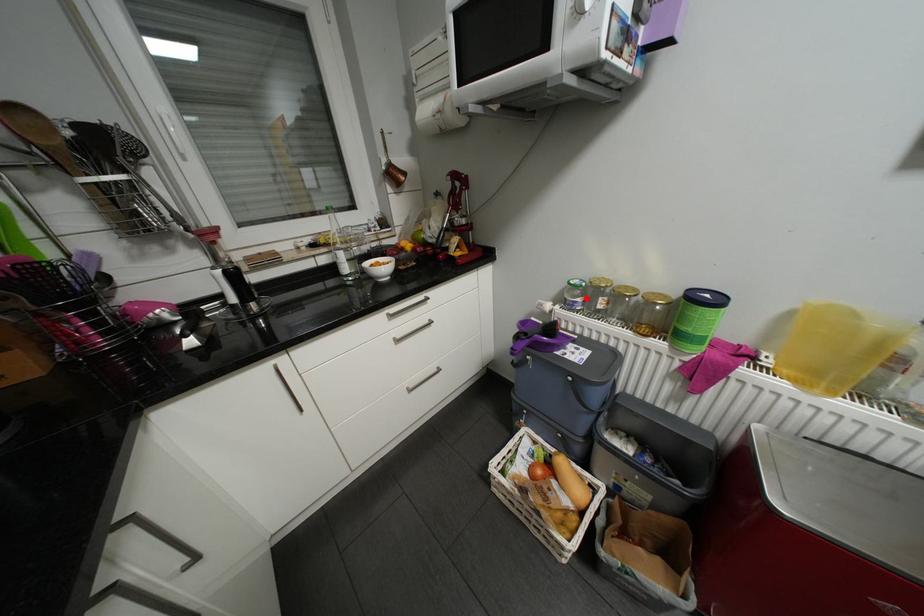
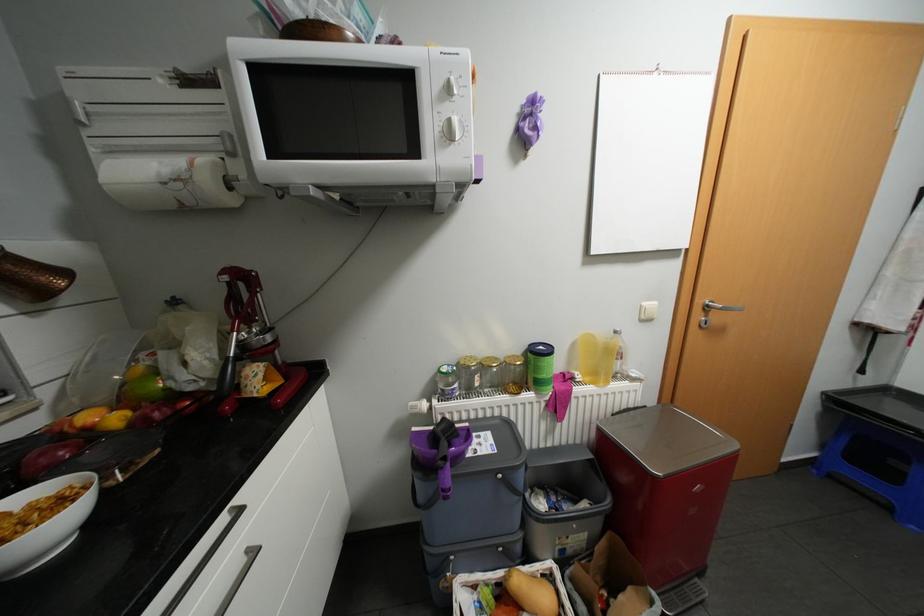
The point at the highlighted location is marked in the first image. Where is the corresponding point in the second image?

(464, 384)